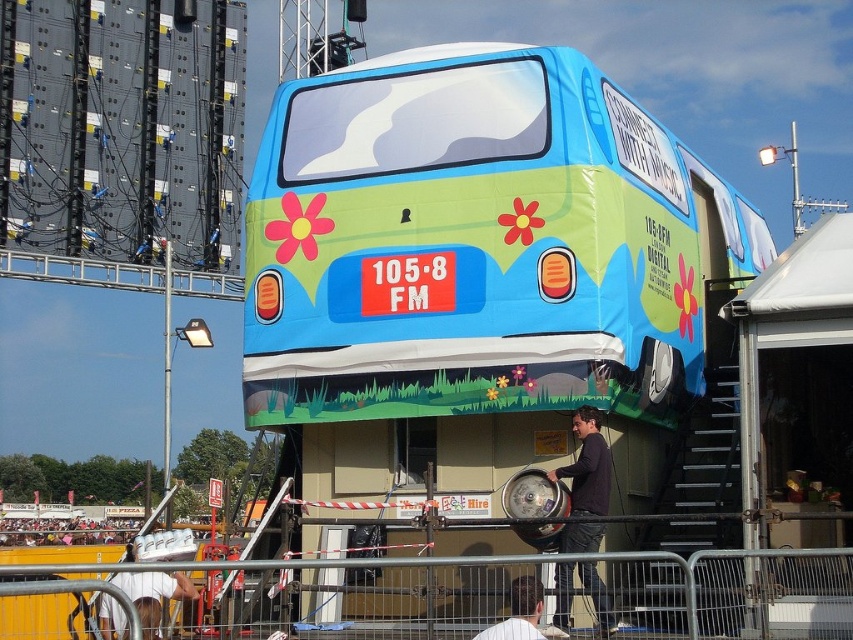
Is dark brown leather jacket at lower center positioned at the back of white fabric at lower left?

No.

Which of these two, dark brown leather jacket at lower center or white fabric at lower left, stands taller?

With more height is dark brown leather jacket at lower center.

Describe the element at coordinates (587, 467) in the screenshot. I see `dark brown leather jacket at lower center` at that location.

Image resolution: width=853 pixels, height=640 pixels. What are the coordinates of `dark brown leather jacket at lower center` in the screenshot? It's located at (587, 467).

Can you confirm if matte blue van at center is positioned above metal at lower center?

Yes, matte blue van at center is above metal at lower center.

Can you confirm if matte blue van at center is smaller than metal at lower center?

No.

Which is behind, point (248, 250) or point (757, 573)?

The point (248, 250) is behind.

Locate an element on the screen. The image size is (853, 640). matte blue van at center is located at coordinates (479, 243).

What do you see at coordinates (479, 243) in the screenshot?
I see `matte blue van at center` at bounding box center [479, 243].

Who is taller, matte blue van at center or white shirt at lower center?

matte blue van at center

Does point (285, 214) come in front of point (519, 582)?

No, (285, 214) is behind (519, 582).

Identify the location of matte blue van at center. (479, 243).